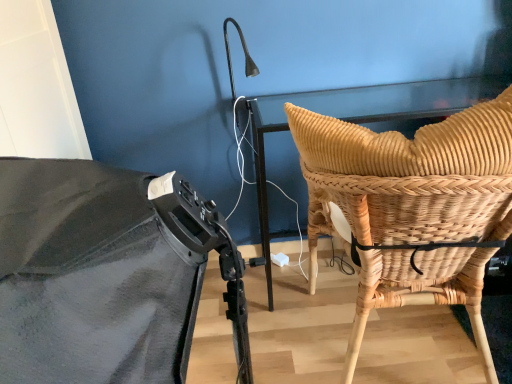
Question: Looking at their shapes, would you say woven natural wood chair back at right is wider or thinner than woven wood chair at right?

Choices:
 (A) wide
 (B) thin

Answer: (B)

Question: Is woven natural wood chair back at right inside or outside of woven wood chair at right?

Choices:
 (A) inside
 (B) outside

Answer: (A)

Question: Considering the relative positions of woven natural wood chair back at right and woven wood chair at right in the image provided, is woven natural wood chair back at right to the left or to the right of woven wood chair at right?

Choices:
 (A) right
 (B) left

Answer: (A)

Question: In the image, is woven wood chair at right on the left side or the right side of woven natural wood chair back at right?

Choices:
 (A) left
 (B) right

Answer: (A)

Question: From their relative heights in the image, would you say woven wood chair at right is taller or shorter than woven natural wood chair back at right?

Choices:
 (A) short
 (B) tall

Answer: (B)

Question: Choose the correct answer: Is woven wood chair at right inside woven natural wood chair back at right or outside it?

Choices:
 (A) outside
 (B) inside

Answer: (A)

Question: Considering their positions, is woven wood chair at right located in front of or behind woven natural wood chair back at right?

Choices:
 (A) behind
 (B) front

Answer: (B)